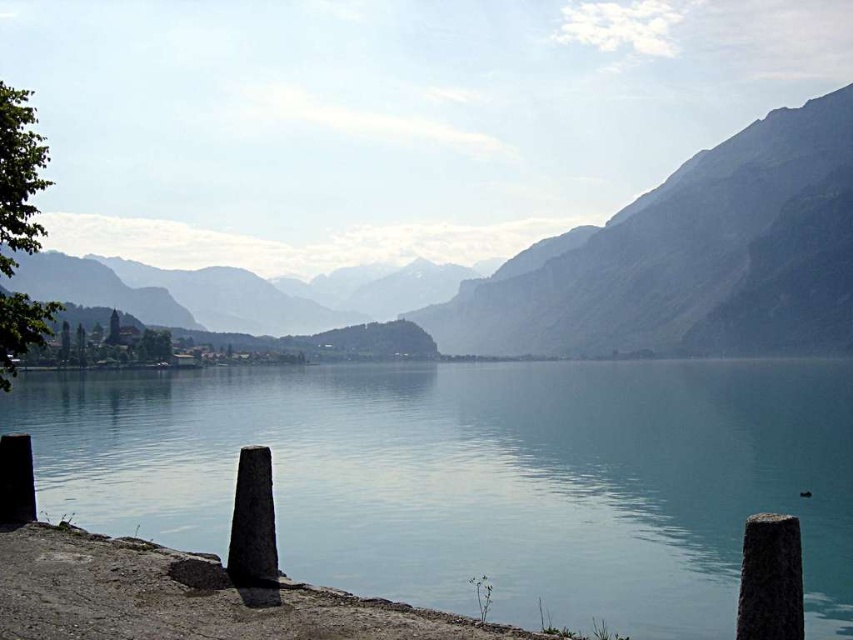
Question: Is rocky gray mountain at center further to camera compared to gray stone post at lower left?

Choices:
 (A) no
 (B) yes

Answer: (B)

Question: Which point is farther to the camera?

Choices:
 (A) rocky gray mountain at center
 (B) smooth concrete posts at lower center

Answer: (A)

Question: Which is nearer to the rocky gray mountain at center?

Choices:
 (A) smooth concrete posts at lower center
 (B) gray stone post at lower left

Answer: (A)

Question: Which point is farther to the camera?

Choices:
 (A) rocky gray mountain at center
 (B) smooth concrete posts at lower center
 (C) gray stone post at lower left

Answer: (A)

Question: Is smooth concrete posts at lower center further to the viewer compared to gray stone post at lower left?

Choices:
 (A) no
 (B) yes

Answer: (A)

Question: Can you confirm if smooth concrete posts at lower center is bigger than gray stone post at lower left?

Choices:
 (A) yes
 (B) no

Answer: (A)